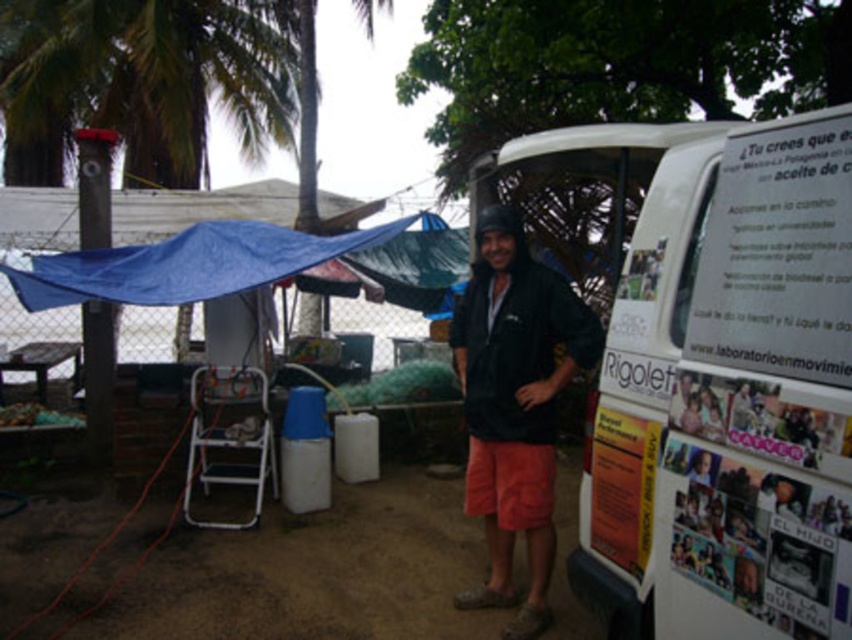
Between white glossy van at center and blue tarp at upper left, which one appears on the left side from the viewer's perspective?

Positioned to the left is blue tarp at upper left.

Between point (717, 240) and point (461, 248), which one is positioned behind?

Point (461, 248)

Locate an element on the screen. The image size is (852, 640). white glossy van at center is located at coordinates (720, 380).

Can you confirm if green leafy palm tree at upper left is wider than blue tarp at upper left?

No.

The height and width of the screenshot is (640, 852). What do you see at coordinates (150, 74) in the screenshot?
I see `green leafy palm tree at upper left` at bounding box center [150, 74].

The image size is (852, 640). I want to click on green leafy palm tree at upper left, so click(x=150, y=74).

Locate an element on the screen. This screenshot has height=640, width=852. green leafy palm tree at upper left is located at coordinates (150, 74).

The width and height of the screenshot is (852, 640). What do you see at coordinates (150, 74) in the screenshot?
I see `green leafy palm tree at upper left` at bounding box center [150, 74].

Is point (79, 118) farther from viewer compared to point (488, 588)?

Yes, point (79, 118) is farther from viewer.

At what (x,y) coordinates should I click in order to perform the action: click on green leafy palm tree at upper left. Please return your answer as a coordinate pair (x, y). This screenshot has width=852, height=640. Looking at the image, I should click on (150, 74).